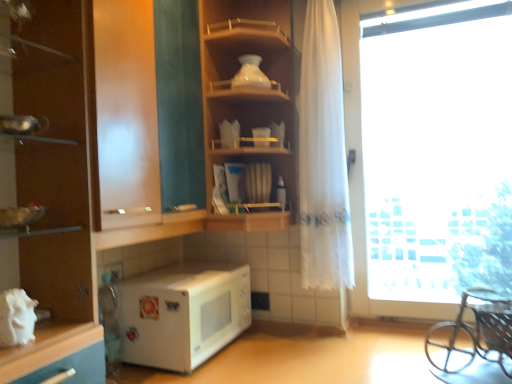
Where is `vacant point above white matte microwave at lower left (from a real-world perspective)`? This screenshot has width=512, height=384. vacant point above white matte microwave at lower left (from a real-world perspective) is located at coordinates click(188, 275).